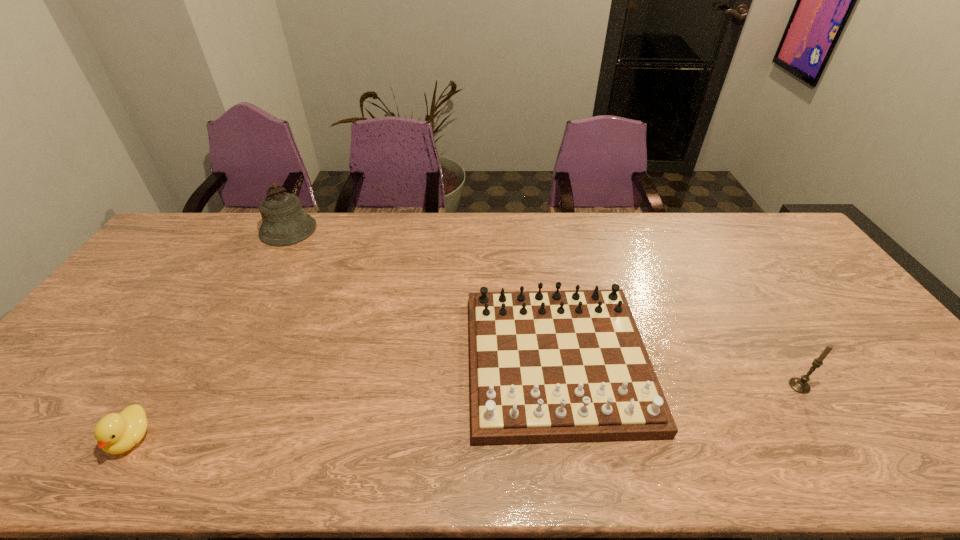
Identify the location of the tallest object. (285, 223).

This screenshot has width=960, height=540. Find the location of `bell`. bell is located at coordinates (285, 223).

You are a GUI agent. You are given a task and a screenshot of the screen. Output one action in this format:
    pyautogui.click(x=<x>, y=<y>)
    Task: Click on the rightmost object
    The width and height of the screenshot is (960, 540).
    Given the screenshot: What is the action you would take?
    pyautogui.click(x=800, y=385)

At what (x,y) coordinates should I click in order to perform the action: click on the second tallest object. Please return your answer as a coordinate pair (x, y). Looking at the image, I should click on (800, 385).

Find the location of a particular element. The height and width of the screenshot is (540, 960). the second object from right to left is located at coordinates (557, 366).

At what (x,y) coordinates should I click in order to perform the action: click on duckling. Please return your answer as a coordinate pair (x, y). This screenshot has height=540, width=960. Looking at the image, I should click on (115, 433).

Find the location of a particular element. This screenshot has height=540, width=960. free space located 0.200m on the left of the bell is located at coordinates (204, 230).

Identify the location of vacant region located on the back of the rightmost object. [x=740, y=292].

I want to click on vacant space situated 0.080m on the left of the chessboard, so coord(437,361).

The image size is (960, 540). In order to click on object present at the far edge in this screenshot , I will do `click(285, 223)`.